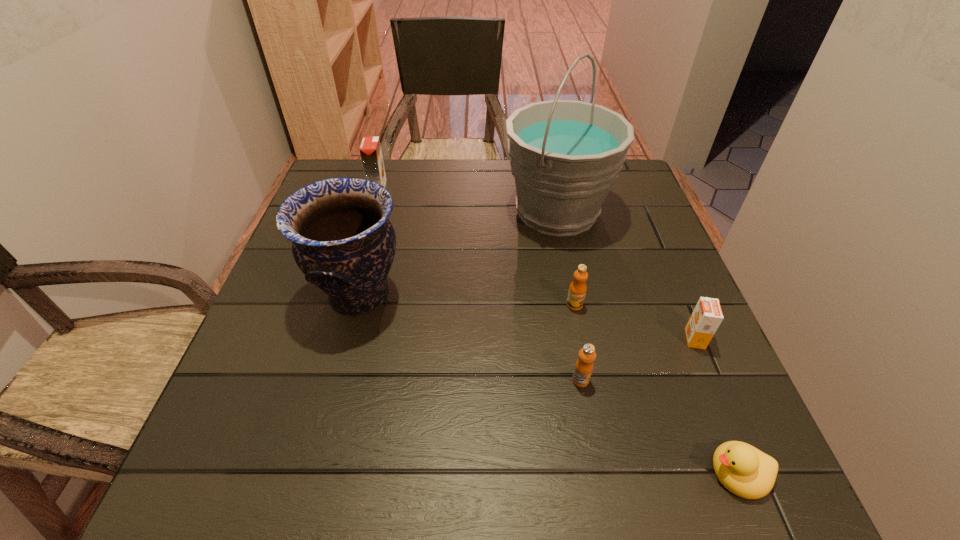
At what (x,y) coordinates should I click in order to perform the action: click on bucket. Please return your answer as a coordinate pair (x, y). The height and width of the screenshot is (540, 960). Looking at the image, I should click on (564, 154).

This screenshot has height=540, width=960. Find the location of `pottery`. pottery is located at coordinates (342, 240).

The image size is (960, 540). I want to click on the leftmost orange juice, so click(370, 149).

The width and height of the screenshot is (960, 540). I want to click on the tallest orange juice, so tap(370, 149).

At what (x,y) coordinates should I click in order to perform the action: click on the second farthest orange juice. Please return your answer as a coordinate pair (x, y). Looking at the image, I should click on (577, 290).

The height and width of the screenshot is (540, 960). I want to click on the rightmost orange juice, so click(x=706, y=317).

The height and width of the screenshot is (540, 960). Identify the location of the sixth farthest object. (583, 368).

The height and width of the screenshot is (540, 960). I want to click on duckling, so click(744, 470).

What are the coordinates of `the nearest object` in the screenshot? It's located at (744, 470).

You are a GUI agent. You are given a task and a screenshot of the screen. Output one action in this format:
    pyautogui.click(x=<x>, y=<y>)
    Task: Click on the vacant space located 0.170m on the left of the tallest object
    
    Given the screenshot: What is the action you would take?
    pyautogui.click(x=439, y=212)